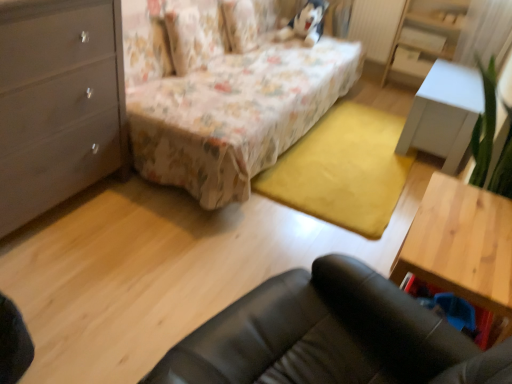
Locate an element on the screen. floral fabric bed at center is located at coordinates (229, 100).

What is the approximate height of floral fabric bed at center?

floral fabric bed at center is 94.54 centimeters in height.

This screenshot has height=384, width=512. What do you see at coordinates (461, 245) in the screenshot? I see `wooden table at lower right, positioned as the first table in front-to-back order` at bounding box center [461, 245].

The height and width of the screenshot is (384, 512). Describe the element at coordinates (444, 114) in the screenshot. I see `white glossy table at right, the 1th table positioned from the back` at that location.

What is the approximate width of white sheer curtain at upper right?

The width of white sheer curtain at upper right is 13.81 centimeters.

What do you see at coordinates (410, 62) in the screenshot?
I see `white matte drawer at upper right` at bounding box center [410, 62].

Image resolution: width=512 pixels, height=384 pixels. Describe the element at coordinates (194, 33) in the screenshot. I see `floral fabric pillow at upper center` at that location.

Consider the image. Measure the distance between point [170,9] and camera.

Point [170,9] is 2.35 meters from camera.

Measure the distance between matte gray dresser at left and camera.

They are 1.32 meters apart.

Identify the location of floral fabric bed at center. Image resolution: width=512 pixels, height=384 pixels. (229, 100).

Who is shorter, white glossy dresser at upper right or wooden table at lower right, the 1th table positioned from the left?

wooden table at lower right, the 1th table positioned from the left.

From a real-world perspective, who is located higher, white glossy dresser at upper right or wooden table at lower right, the 1th table positioned from the left?

In real-world perspective, white glossy dresser at upper right is above.

Could you measure the distance between white glossy dresser at upper right and wooden table at lower right, which is the 1th table in bottom-to-top order?

A distance of 2.32 meters exists between white glossy dresser at upper right and wooden table at lower right, which is the 1th table in bottom-to-top order.

Is white glossy dresser at upper right turned away from wooden table at lower right, positioned as the first table in front-to-back order?

No, white glossy dresser at upper right is not facing the opposite direction of wooden table at lower right, positioned as the first table in front-to-back order.

Would you say floral fabric bed at center is to the left or to the right of floral fabric pillow at upper center in the picture?

floral fabric bed at center is positioned on floral fabric pillow at upper center's right side.

Is floral fabric bed at center wider or thinner than floral fabric pillow at upper center?

In the image, floral fabric bed at center appears to be wider than floral fabric pillow at upper center.

How distant is floral fabric bed at center from floral fabric pillow at upper center?

The distance of floral fabric bed at center from floral fabric pillow at upper center is 12.36 inches.

Find the location of a particular element. This screenshot has width=512, height=384. bed that appears below the floral fabric pillow at upper center (from a real-world perspective) is located at coordinates (229, 100).

Consider the image. From the image's perspective, who appears lower, white sheer curtain at upper right or white matte drawer at upper right?

white matte drawer at upper right, from the image's perspective.

Does point (494, 0) come behind point (398, 62)?

No, it is not.

Which object is thinner, white sheer curtain at upper right or white matte drawer at upper right?

With smaller width is white matte drawer at upper right.

Is white sheer curtain at upper right positioned before white matte drawer at upper right?

Yes.

Locate an element on the screen. This screenshot has width=512, height=384. bed above the white matte drawer at upper right (from a real-world perspective) is located at coordinates (229, 100).

Is white matte drawer at upper right oriented away from floral fabric bed at center?

white matte drawer at upper right is not turned away from floral fabric bed at center.

Which object is positioned more to the right, white matte drawer at upper right or floral fabric bed at center?

white matte drawer at upper right is more to the right.

How much distance is there between white matte drawer at upper right and floral fabric bed at center?

They are 1.61 meters apart.

From a real-world perspective, is wooden table at lower right, the 2th table from the right, positioned above or below floral fabric pillow at upper center?

wooden table at lower right, the 2th table from the right, is below floral fabric pillow at upper center.

Are wooden table at lower right, the second table viewed from the top, and floral fabric pillow at upper center making contact?

They are not placed beside each other.

Consider the image. Is wooden table at lower right, the 1th table positioned from the left, aimed at floral fabric pillow at upper center?

Yes, wooden table at lower right, the 1th table positioned from the left, is aimed at floral fabric pillow at upper center.

Can you confirm if matte gray dresser at left is wider than white glossy dresser at upper right?

Correct, the width of matte gray dresser at left exceeds that of white glossy dresser at upper right.

Which is closer to the camera, (x=77, y=95) or (x=444, y=41)?

The point (x=77, y=95) is closer.

Can you tell me how much matte gray dresser at left and white glossy dresser at upper right differ in facing direction?

The angular difference between matte gray dresser at left and white glossy dresser at upper right is 90.3 degrees.

Would you say wooden table at lower right, which is the 1th table in bottom-to-top order, is outside white glossy dresser at upper right?

wooden table at lower right, which is the 1th table in bottom-to-top order, is positioned outside white glossy dresser at upper right.

Which is closer to the camera, (x=465, y=218) or (x=438, y=15)?

Point (x=465, y=218).

From a real-world perspective, is wooden table at lower right, the 2th table from the right, located beneath white glossy dresser at upper right?

Yes, from a real-world perspective, wooden table at lower right, the 2th table from the right, is below white glossy dresser at upper right.

Does wooden table at lower right, the 2th table from the right, have a greater height compared to white glossy dresser at upper right?

Incorrect, the height of wooden table at lower right, the 2th table from the right, is not larger of that of white glossy dresser at upper right.

Which table is the 2nd one when counting from the left side of the white glossy dresser at upper right? Please provide its 2D coordinates.

[(461, 245)]

Identify the location of pillow above the floral fabric bed at center (from a real-world perspective). This screenshot has height=384, width=512. (194, 33).

Considering their positions, is white glossy table at right, marked as the first table in a right-to-left arrangement, positioned further to wooden table at lower right, positioned as the first table in front-to-back order, than white matte drawer at upper right?

white matte drawer at upper right.

Estimate the real-world distances between objects in this image. Which object is further from floral fabric pillow at upper center, floral fabric bed at center or white sheer curtain at upper right?

The object further to floral fabric pillow at upper center is white sheer curtain at upper right.

Consider the image. Based on their spatial positions, is matte gray dresser at left or white matte drawer at upper right further from wooden table at lower right, the 2th table from the right?

white matte drawer at upper right is positioned further to the anchor wooden table at lower right, the 2th table from the right.

Based on their spatial positions, is white glossy dresser at upper right or white matte drawer at upper right further from floral fabric bed at center?

white matte drawer at upper right is further to floral fabric bed at center.

Considering their positions, is wooden table at lower right, the second table viewed from the top, positioned further to white sheer curtain at upper right than floral fabric bed at center?

wooden table at lower right, the second table viewed from the top, is further to white sheer curtain at upper right.

Looking at the image, which one is located closer to matte gray dresser at left, wooden table at lower right, the second table viewed from the top, or floral fabric pillow at upper center?

floral fabric pillow at upper center lies closer to matte gray dresser at left than the other object.

Which object lies nearer to the anchor point white glossy dresser at upper right, floral fabric pillow at upper center or white matte drawer at upper right?

white matte drawer at upper right.

When comparing their distances from white glossy dresser at upper right, does matte gray dresser at left or white matte drawer at upper right seem further?

matte gray dresser at left.

At what (x,y) coordinates should I click in order to perform the action: click on bed between matte gray dresser at left and floral fabric pillow at upper center in the front-back direction. Please return your answer as a coordinate pair (x, y). This screenshot has width=512, height=384. Looking at the image, I should click on (229, 100).

The width and height of the screenshot is (512, 384). What are the coordinates of `pillow between floral fabric bed at center and wooden table at lower right, the 2th table from the right, in the vertical direction` in the screenshot? It's located at (194, 33).

What are the coordinates of `dresser positioned between wooden table at lower right, the 2th table from the right, and white matte drawer at upper right from near to far` in the screenshot? It's located at (424, 38).

Image resolution: width=512 pixels, height=384 pixels. Identify the location of dresser located between white sheer curtain at upper right and white matte drawer at upper right in the depth direction. (424, 38).